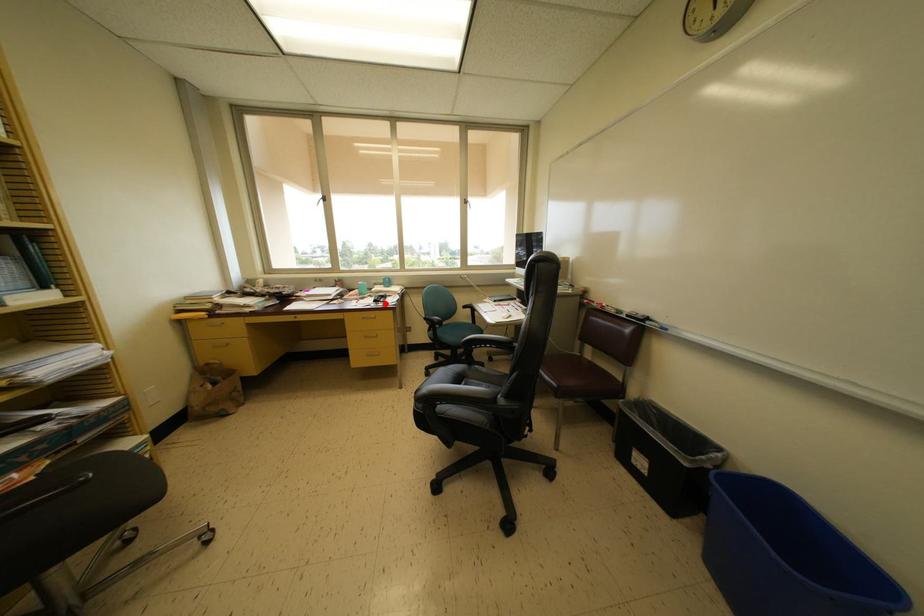
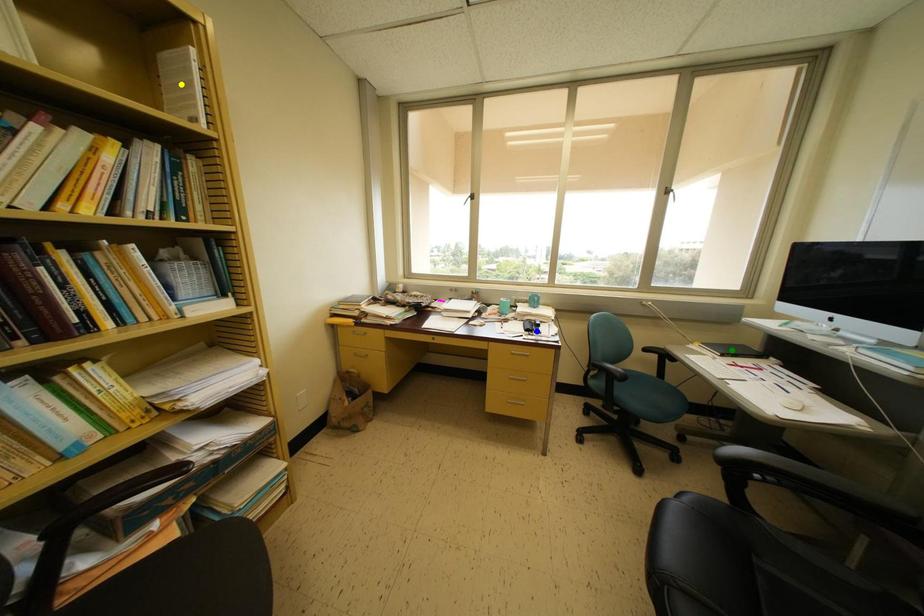
Question: I am providing you with two images of the same scene from different viewpoints. A red point is marked on the first image. You are given multiple points on the second image. Can you choose the point in image 2 that corresponds to the point in image 1?

Choices:
 (A) green point
 (B) yellow point
 (C) blue point

Answer: (C)